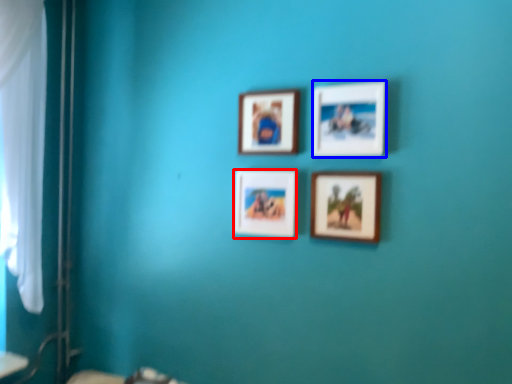
Question: Which object is further to the camera taking this photo, picture frame (highlighted by a red box) or picture frame (highlighted by a blue box)?

Choices:
 (A) picture frame
 (B) picture frame

Answer: (A)